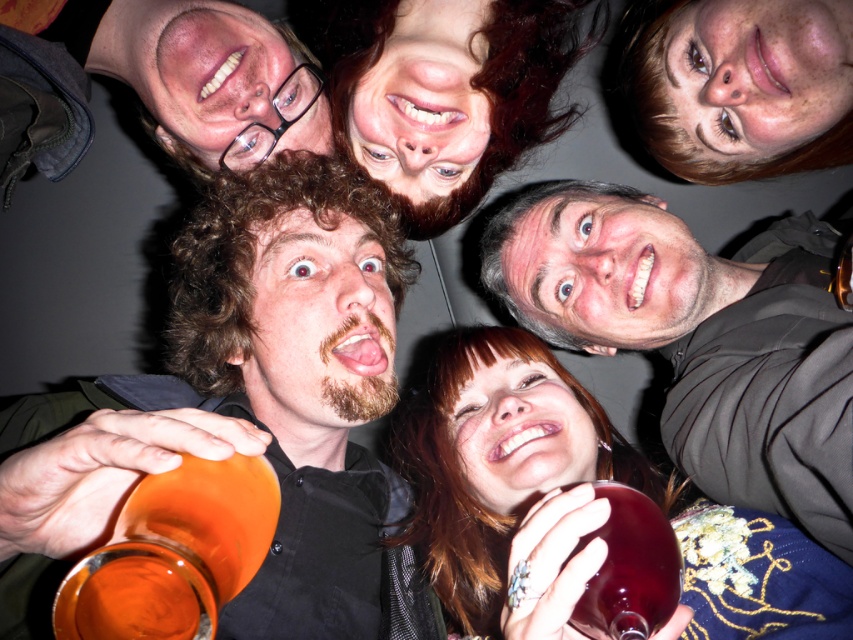
You are at a party and want to grab a drink. There are two glasses in front of you. The orange glass at lower left and the translucent glass wine at center. Which one is positioned more to the left?

The orange glass at lower left is positioned more to the left than the translucent glass wine at center.

You are at a party and want to grab a drink. You see an orange glass mug at center and a translucent glass wine at center. Which one is on the left side?

The orange glass mug at center is on the left side of the translucent glass wine at center.